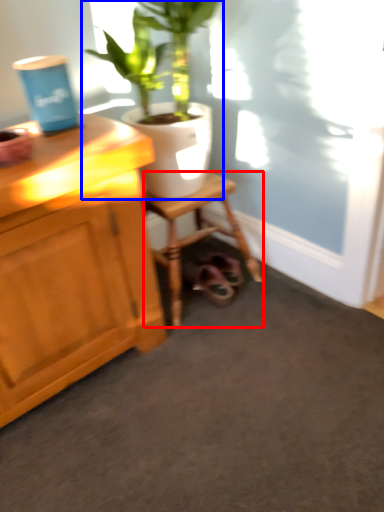
Question: Which object is closer to the camera taking this photo, stool (highlighted by a red box) or houseplant (highlighted by a blue box)?

Choices:
 (A) stool
 (B) houseplant

Answer: (B)